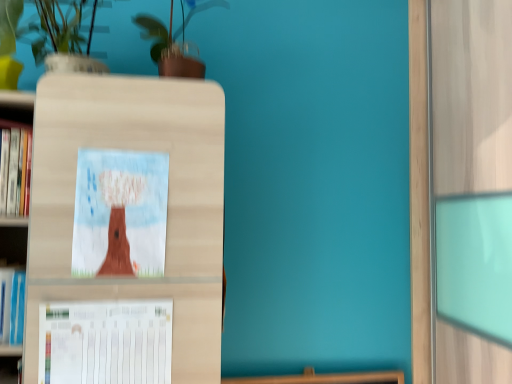
This screenshot has width=512, height=384. Describe the element at coordinates (46, 28) in the screenshot. I see `white matte vase at upper left` at that location.

This screenshot has width=512, height=384. Describe the element at coordinates (120, 213) in the screenshot. I see `matte cardboard picture frame at center` at that location.

What do you see at coordinates (105, 342) in the screenshot? The height and width of the screenshot is (384, 512). I see `white paper at lower left` at bounding box center [105, 342].

Locate an element on the screen. white paper at lower left is located at coordinates (105, 342).

Find the location of a particular element. Image resolution: width=512 pixels, height=384 pixels. white matte vase at upper left is located at coordinates (46, 28).

Does white paper at lower left have a larger size compared to matte cardboard picture frame at center?

Yes, white paper at lower left is bigger than matte cardboard picture frame at center.

Which object is further away from the camera, white paper at lower left or matte cardboard picture frame at center?

Positioned behind is matte cardboard picture frame at center.

Can you confirm if white paper at lower left is positioned to the left of matte cardboard picture frame at center?

Yes.

At what (x,y) coordinates should I click in order to perform the action: click on picture frame located above the white paper at lower left (from the image's perspective). Please return your answer as a coordinate pair (x, y). Image resolution: width=512 pixels, height=384 pixels. Looking at the image, I should click on (120, 213).

Who is more distant, matte cardboard picture frame at center or white paper at lower left?

matte cardboard picture frame at center is more distant.

How different are the orientations of matte cardboard picture frame at center and white paper at lower left in degrees?

They differ by 0.0125 degrees in their facing directions.

Is matte cardboard picture frame at center positioned with its back to white paper at lower left?

No, matte cardboard picture frame at center is not facing the opposite direction of white paper at lower left.

Choose the correct answer: Is white matte vase at upper left inside matte cardboard picture frame at center or outside it?

white matte vase at upper left is outside matte cardboard picture frame at center.

Which is in front, point (149, 16) or point (85, 204)?

Point (85, 204)

Considering the relative positions of white matte vase at upper left and matte cardboard picture frame at center in the image provided, is white matte vase at upper left to the left of matte cardboard picture frame at center from the viewer's perspective?

Indeed, white matte vase at upper left is positioned on the left side of matte cardboard picture frame at center.

How different are the orientations of white matte vase at upper left and green glossy plant at upper center in degrees?

The angular difference between white matte vase at upper left and green glossy plant at upper center is 1.22e-05 degrees.

From the image's perspective, which one is positioned higher, white matte vase at upper left or green glossy plant at upper center?

green glossy plant at upper center.

Visually, is white matte vase at upper left positioned to the left or to the right of green glossy plant at upper center?

white matte vase at upper left is to the left of green glossy plant at upper center.

Is white matte vase at upper left situated inside green glossy plant at upper center or outside?

white matte vase at upper left is located beyond the bounds of green glossy plant at upper center.

Is white paper at lower left looking in the opposite direction of green glossy plant at upper center?

That's not correct — white paper at lower left is not looking away from green glossy plant at upper center.

In the scene shown: Does white paper at lower left have a lesser width compared to green glossy plant at upper center?

Indeed, white paper at lower left has a lesser width compared to green glossy plant at upper center.

Is green glossy plant at upper center in front of or behind white paper at lower left in the image?

Clearly, green glossy plant at upper center is behind white paper at lower left.

Does green glossy plant at upper center have a lesser height compared to white paper at lower left?

No, green glossy plant at upper center is not shorter than white paper at lower left.

From a real-world perspective, is green glossy plant at upper center over white paper at lower left?

Yes, from a real-world perspective, green glossy plant at upper center is on top of white paper at lower left.

Which object is positioned more to the left, green glossy plant at upper center or white paper at lower left?

white paper at lower left.

Looking at this image, from the image's perspective, which one is positioned lower, white matte vase at upper left or white paper at lower left?

white paper at lower left is shown below in the image.

Who is taller, white matte vase at upper left or white paper at lower left?

Standing taller between the two is white matte vase at upper left.

Is white matte vase at upper left turned away from white paper at lower left?

white matte vase at upper left does not have its back to white paper at lower left.

Is white matte vase at upper left bigger or smaller than white paper at lower left?

Clearly, white matte vase at upper left is larger in size than white paper at lower left.

Find the location of `paperback book lying below the matte cardboard picture frame at center (from the image's perspective)`. paperback book lying below the matte cardboard picture frame at center (from the image's perspective) is located at coordinates (105, 342).

Find the location of a particular element. paperback book on the left of matte cardboard picture frame at center is located at coordinates (105, 342).

From the image, which object appears to be nearer to green glossy plant at upper center, matte cardboard picture frame at center or white paper at lower left?

Based on the image, matte cardboard picture frame at center appears to be nearer to green glossy plant at upper center.

Estimate the real-world distances between objects in this image. Which object is further from white paper at lower left, matte cardboard picture frame at center or white matte vase at upper left?

The object further to white paper at lower left is white matte vase at upper left.

Based on their spatial positions, is white paper at lower left or green glossy plant at upper center closer to white matte vase at upper left?

Based on the image, green glossy plant at upper center appears to be nearer to white matte vase at upper left.

Estimate the real-world distances between objects in this image. Which object is further from white paper at lower left, green glossy plant at upper center or matte cardboard picture frame at center?

Among the two, green glossy plant at upper center is located further to white paper at lower left.

Estimate the real-world distances between objects in this image. Which object is further from green glossy plant at upper center, white matte vase at upper left or white paper at lower left?

white paper at lower left is further to green glossy plant at upper center.

Based on their spatial positions, is white paper at lower left or matte cardboard picture frame at center closer to green glossy plant at upper center?

Among the two, matte cardboard picture frame at center is located nearer to green glossy plant at upper center.

Based on their spatial positions, is green glossy plant at upper center or matte cardboard picture frame at center further from white matte vase at upper left?

Based on the image, matte cardboard picture frame at center appears to be further to white matte vase at upper left.

Which object lies further to the anchor point green glossy plant at upper center, white paper at lower left or white matte vase at upper left?

white paper at lower left is further to green glossy plant at upper center.

Where is `picture frame between white matte vase at upper left and white paper at lower left in the vertical direction`? This screenshot has height=384, width=512. picture frame between white matte vase at upper left and white paper at lower left in the vertical direction is located at coordinates (120, 213).

Where is `picture frame between green glossy plant at upper center and white paper at lower left in the vertical direction`? This screenshot has height=384, width=512. picture frame between green glossy plant at upper center and white paper at lower left in the vertical direction is located at coordinates (120, 213).

The width and height of the screenshot is (512, 384). In order to click on floral arrangement between green glossy plant at upper center and white paper at lower left in the vertical direction in this screenshot , I will do `click(46, 28)`.

Identify the location of floral arrangement between green glossy plant at upper center and matte cardboard picture frame at center in the up-down direction. This screenshot has width=512, height=384. (46, 28).